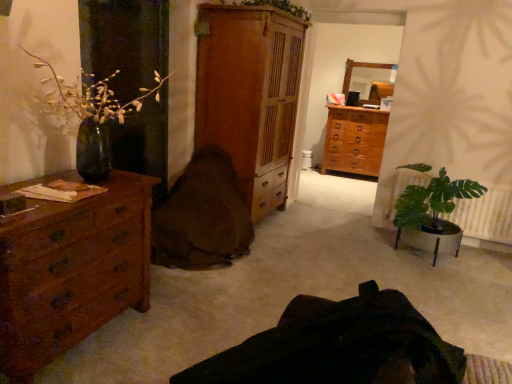
Question: Relative to brown wood chest of drawers at left, the 3th chest of drawers in the back-to-front sequence, is green glossy vase at left, placed as the 2th houseplant when sorted from right to left, in front or behind?

Choices:
 (A) front
 (B) behind

Answer: (B)

Question: Does point (103, 94) appear closer or farther from the camera than point (28, 309)?

Choices:
 (A) farther
 (B) closer

Answer: (A)

Question: Based on their relative distances, which object is farther from the brown wooden chest of drawers at center, which is the third chest of drawers from front to back?

Choices:
 (A) dark brown leather swivel chair at center, placed as the 2th swivel chair when sorted from back to front
 (B) brown fabric swivel chair at center, which appears as the second swivel chair when viewed from the front
 (C) green leafy plant at upper center
 (D) green glossy vase at left, positioned as the 2th houseplant in back-to-front order
 (E) brown wood chest of drawers at left, the 3th chest of drawers in the back-to-front sequence

Answer: (A)

Question: Considering the real-world distances, which object is farthest from the brown fabric swivel chair at center, which appears as the second swivel chair when viewed from the front?

Choices:
 (A) wooden cabinet at center, which ranks as the second chest of drawers in right-to-left order
 (B) green leafy plant at lower right, placed as the second houseplant when sorted from left to right
 (C) green glossy vase at left, placed as the 2th houseplant when sorted from right to left
 (D) green leafy plant at upper center
 (E) dark brown leather swivel chair at center, the first swivel chair when ordered from front to back

Answer: (E)